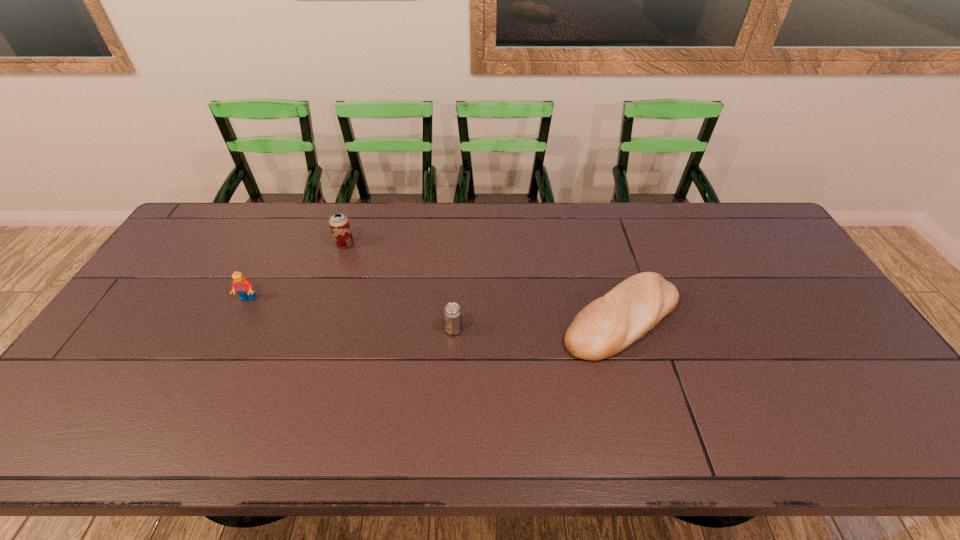
Identify the location of the taller beer can. Image resolution: width=960 pixels, height=540 pixels. (339, 224).

Where is `the farther beer can`? This screenshot has width=960, height=540. the farther beer can is located at coordinates (339, 224).

Image resolution: width=960 pixels, height=540 pixels. In order to click on Lego in this screenshot , I will do `click(243, 287)`.

At what (x,y) coordinates should I click in order to perform the action: click on bread. Please return your answer as a coordinate pair (x, y). Looking at the image, I should click on (609, 324).

The image size is (960, 540). What are the coordinates of `the nearer beer can` in the screenshot? It's located at (452, 313).

The width and height of the screenshot is (960, 540). Find the location of `the right beer can`. the right beer can is located at coordinates (452, 313).

The image size is (960, 540). I want to click on vacant space situated 0.370m on the right of the farthest object, so click(x=466, y=244).

Locate an element on the screen. The image size is (960, 540). free region located on the face of the leftmost object is located at coordinates (229, 336).

Where is `free space located on the left of the rightmost object`? The height and width of the screenshot is (540, 960). free space located on the left of the rightmost object is located at coordinates (520, 319).

Locate an element on the screen. vacant space positioned on the front of the shorter beer can is located at coordinates (447, 449).